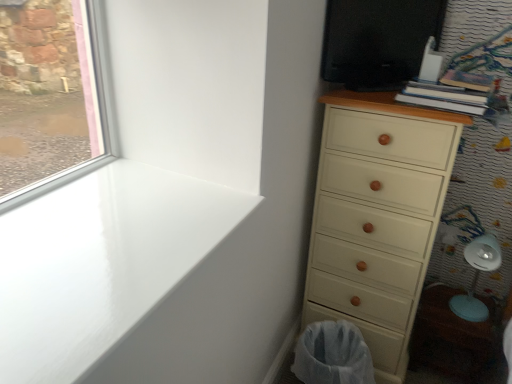
Question: Looking at their shapes, would you say black glossy screen door at upper right is wider or thinner than cream matte chest of drawers at right?

Choices:
 (A) wide
 (B) thin

Answer: (B)

Question: From a real-world perspective, is black glossy screen door at upper right above or below cream matte chest of drawers at right?

Choices:
 (A) below
 (B) above

Answer: (B)

Question: Estimate the real-world distances between objects in this image. Which object is closer to the white mesh laundry basket at lower right?

Choices:
 (A) cream matte chest of drawers at right
 (B) white plastic swivel chair at lower right
 (C) white glossy window sill at upper left
 (D) black glossy screen door at upper right

Answer: (A)

Question: Considering the real-world distances, which object is closest to the white plastic swivel chair at lower right?

Choices:
 (A) white mesh laundry basket at lower right
 (B) cream matte chest of drawers at right
 (C) white glossy window sill at upper left
 (D) black glossy screen door at upper right

Answer: (B)